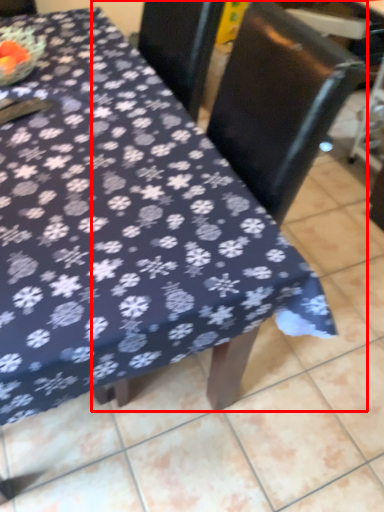
Question: From the image, what is the correct spatial relationship of chair (annotated by the red box) in relation to swivel chair?

Choices:
 (A) right
 (B) left

Answer: (B)